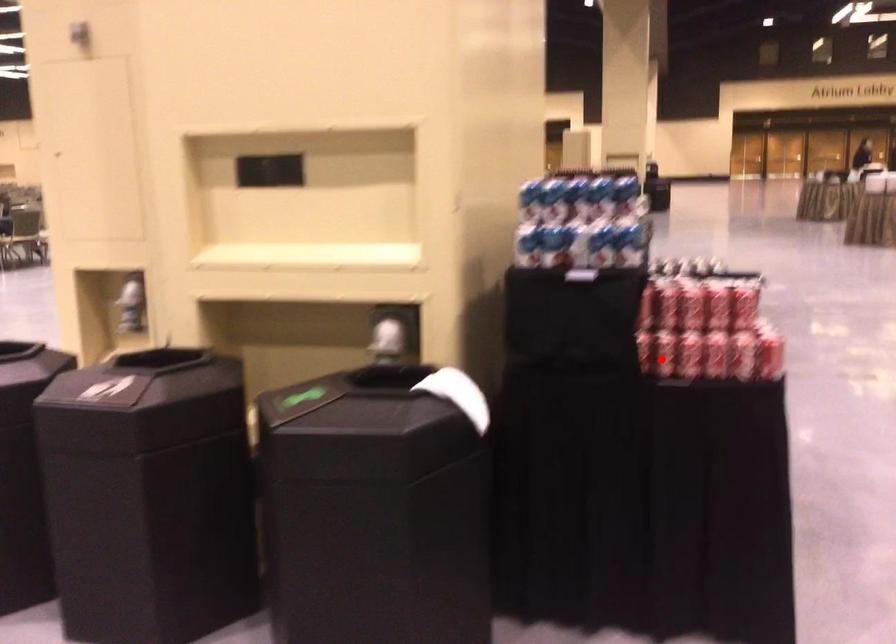
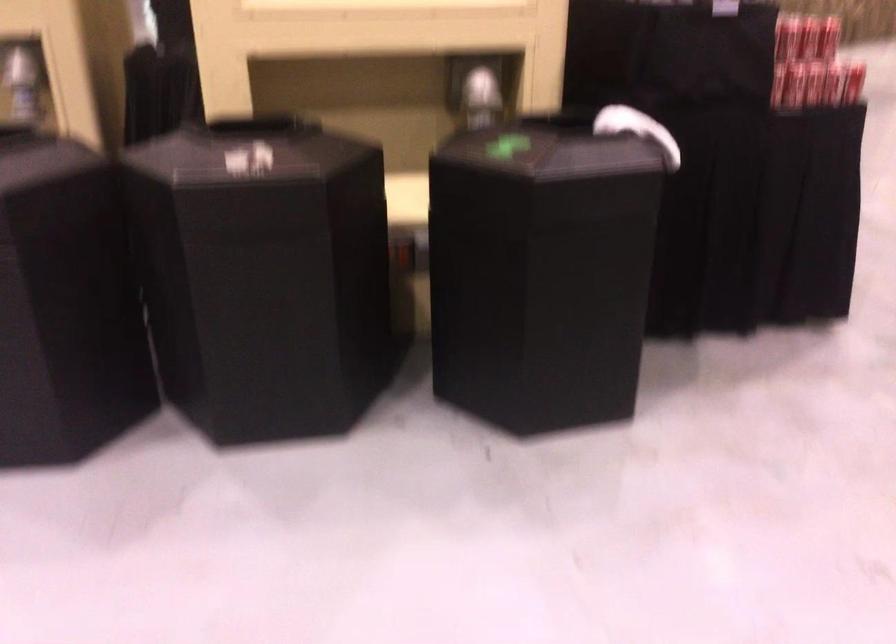
Find the pixel in the second image that matches the highlighted location in the first image.

(788, 84)